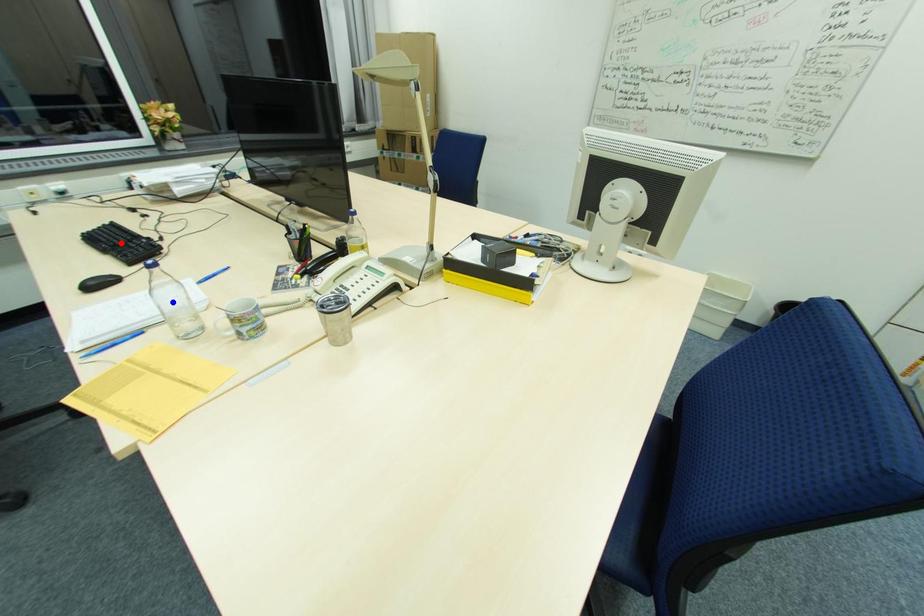
Question: In the image, two points are highlighted. Which point is nearer to the camera? Reply with the corresponding letter.

Choices:
 (A) blue point
 (B) red point

Answer: (A)